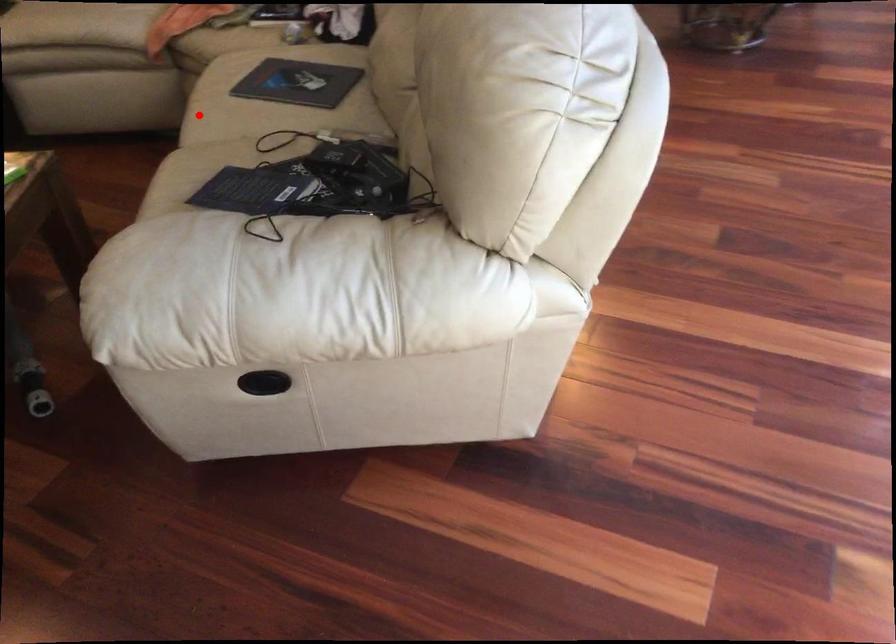
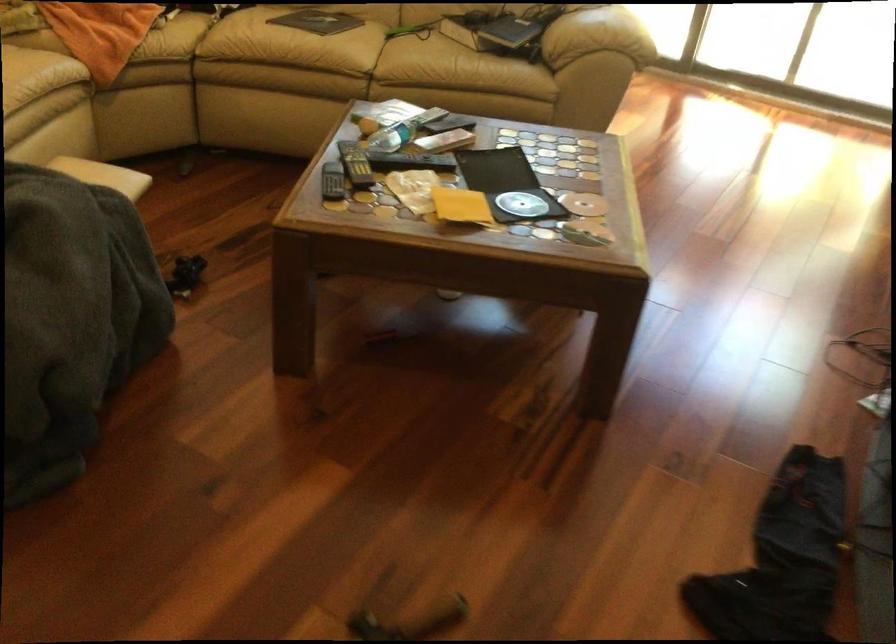
The point at the highlighted location is marked in the first image. Where is the corresponding point in the second image?

(334, 58)